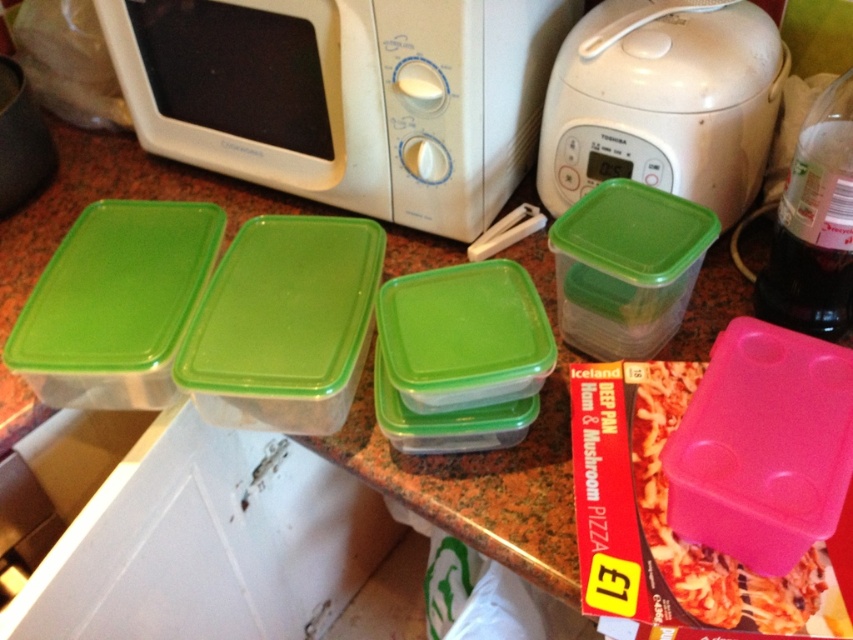
Who is more distant from viewer, (x=701, y=140) or (x=677, y=540)?

Positioned behind is point (x=701, y=140).

Does point (724, 84) come behind point (631, 410)?

Yes, it is.

Measure the distance between white plastic rice cooker at upper center and camera.

They are 28.75 inches apart.

At what (x,y) coordinates should I click in order to perform the action: click on white plastic rice cooker at upper center. Please return your answer as a coordinate pair (x, y). The image size is (853, 640). Looking at the image, I should click on (663, 100).

Which is behind, point (498, 189) or point (693, 45)?

The point (498, 189) is behind.

Does white plastic microwave at upper left have a lesser width compared to white plastic rice cooker at upper center?

No.

Between point (457, 116) and point (706, 32), which one is positioned in front?

Positioned in front is point (457, 116).

You are a GUI agent. You are given a task and a screenshot of the screen. Output one action in this format:
    pyautogui.click(x=<x>, y=<y>)
    Task: Click on the white plastic microwave at upper left
    The width and height of the screenshot is (853, 640).
    Given the screenshot: What is the action you would take?
    pyautogui.click(x=346, y=97)

Is point (412, 92) more distant than point (689, 381)?

Yes, point (412, 92) is behind point (689, 381).

Who is positioned more to the left, white plastic microwave at upper left or pink plastic container at lower right?

white plastic microwave at upper left is more to the left.

Is point (247, 74) less distant than point (686, 577)?

No, it is behind (686, 577).

Where is `white plastic microwave at upper left`? This screenshot has height=640, width=853. white plastic microwave at upper left is located at coordinates (346, 97).